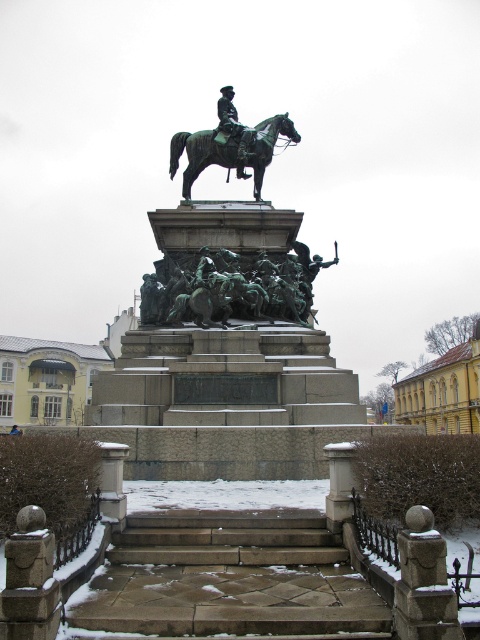
Based on the photo, does green patina bronze figures at center have a lesser height compared to bronze/greenish metal horse at center?

Incorrect, green patina bronze figures at center's height does not fall short of bronze/greenish metal horse at center's.

Is point (192, 276) positioned in front of point (182, 131)?

Yes, it is.

Find the location of a particular element. This screenshot has height=640, width=480. green patina bronze figures at center is located at coordinates (230, 285).

Does green polished metal statue at center appear under bronze/greenish metal horse at center?

Yes, green polished metal statue at center is below bronze/greenish metal horse at center.

Is green polished metal statue at center in front of bronze/greenish metal horse at center?

That is True.

Is point (351, 408) behind point (186, 132)?

No, it is not.

At what (x,y) coordinates should I click in order to perform the action: click on green polished metal statue at center. Please return your answer as a coordinate pair (x, y). The image size is (480, 640). Looking at the image, I should click on (228, 321).

Is green polished metal statue at center closer to the viewer compared to green patina bronze figures at center?

Yes, green polished metal statue at center is in front of green patina bronze figures at center.

Who is taller, green polished metal statue at center or green patina bronze figures at center?

green polished metal statue at center

Is point (237, 330) positioned behind point (222, 248)?

No, (237, 330) is closer to viewer.

Find the location of `green polished metal statue at center`. green polished metal statue at center is located at coordinates (228, 321).